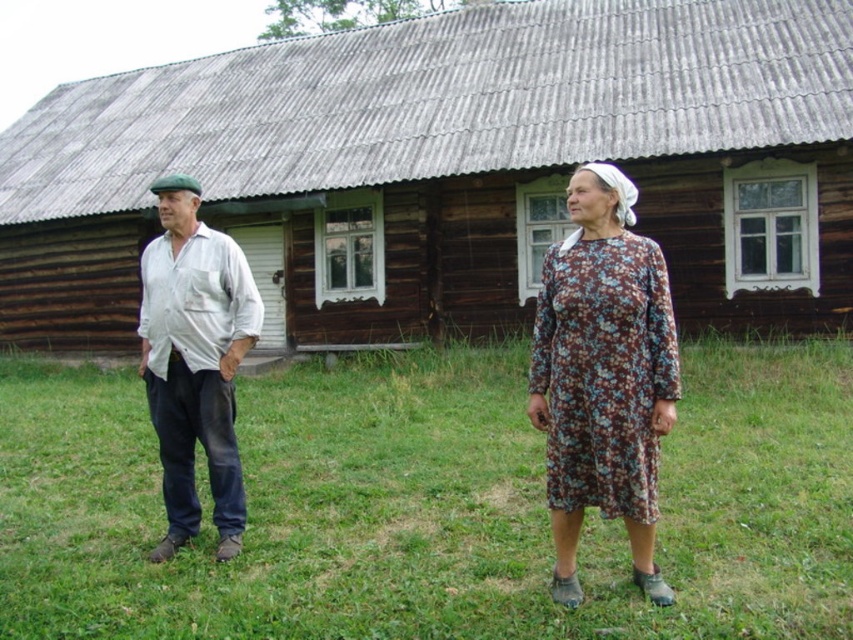
Which is in front, point (758, 163) or point (331, 412)?

Point (331, 412) is more forward.

Does point (216, 209) come farther from viewer compared to point (424, 512)?

Yes, point (216, 209) is behind point (424, 512).

Which is in front, point (445, 269) or point (140, 605)?

Point (140, 605)

Where is `wooden hut at center`? wooden hut at center is located at coordinates (451, 170).

Is green grass at center below white cotton shirt at left?

Indeed, green grass at center is positioned under white cotton shirt at left.

Image resolution: width=853 pixels, height=640 pixels. What are the coordinates of `green grass at center` in the screenshot? It's located at (428, 506).

This screenshot has height=640, width=853. I want to click on green grass at center, so click(428, 506).

Can you confirm if floral cotton dress at center is positioned above white cotton shirt at left?

Correct, floral cotton dress at center is located above white cotton shirt at left.

Does floral cotton dress at center appear under white cotton shirt at left?

No.

Is point (590, 412) positioned before point (184, 512)?

Yes, point (590, 412) is closer to viewer.

Where is `floral cotton dress at center`? This screenshot has width=853, height=640. floral cotton dress at center is located at coordinates (604, 372).